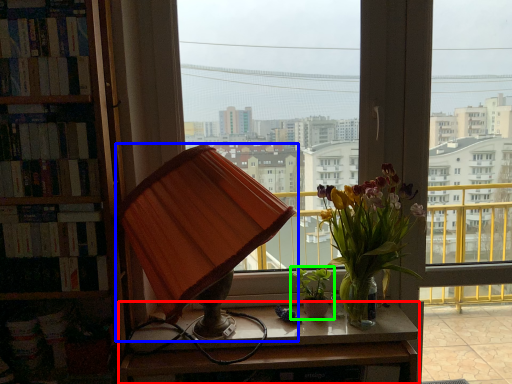
Question: Which object is positioned farthest from desk (highlighted by a red box)? Select from lamp (highlighted by a blue box) and houseplant (highlighted by a green box).

Choices:
 (A) lamp
 (B) houseplant

Answer: (A)